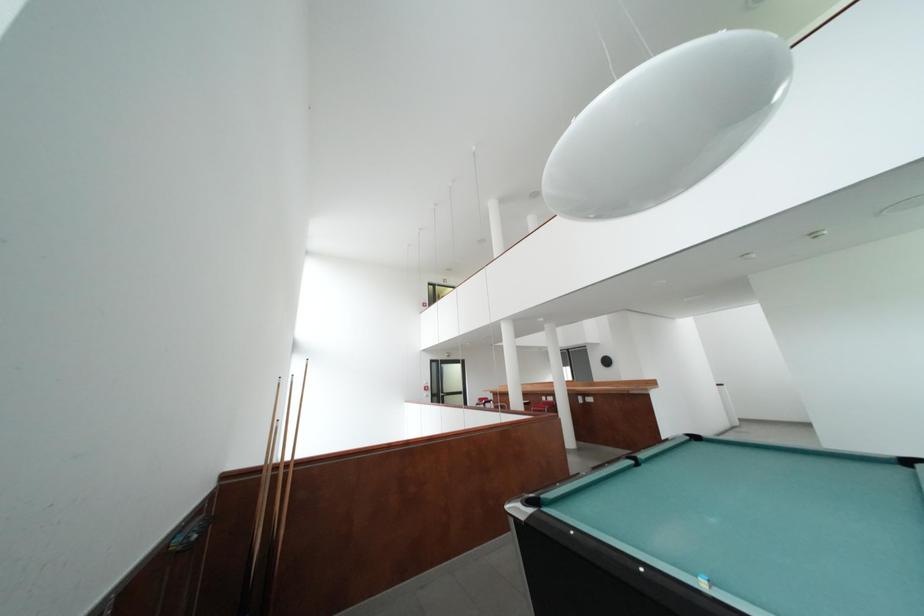
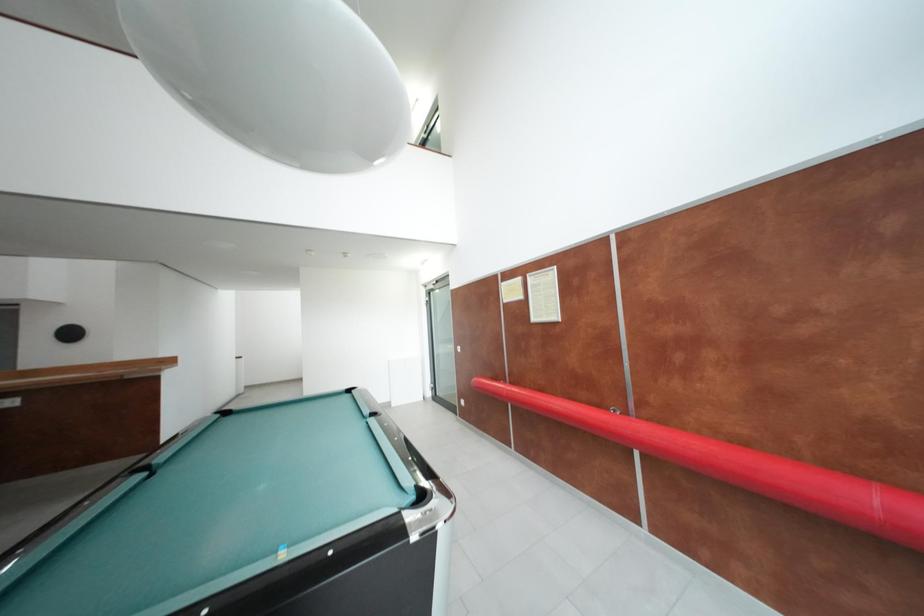
Question: The camera is either moving clockwise (left) or counter-clockwise (right) around the object. The first image is from the beginning of the video and the second image is from the end. Is the camera moving left or right when shooting the video?

Choices:
 (A) Left
 (B) Right

Answer: (A)